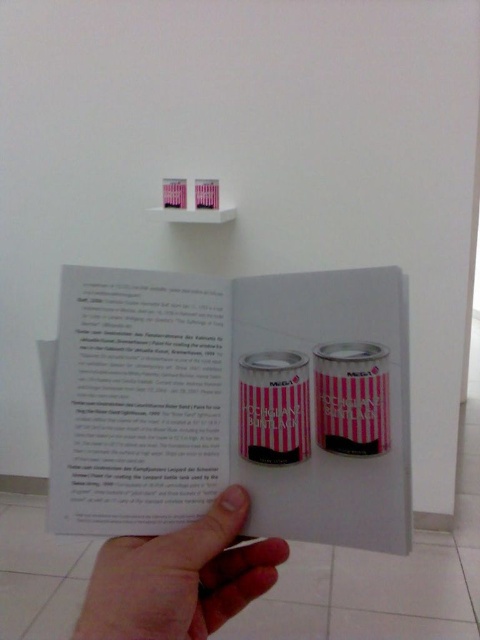
You are an interior designer who needs to place a new rectangular decorative item on the shelf where the pink striped cans at center and pink striped can at center are located. The item is 10 cm in width. Can you fit it between the two cans without moving them?

The pink striped cans at center might be wider than the pink striped can at center, so it is uncertain if there is enough space between them to fit the 10 cm wide decorative item. You should measure the gap first before placing the item.